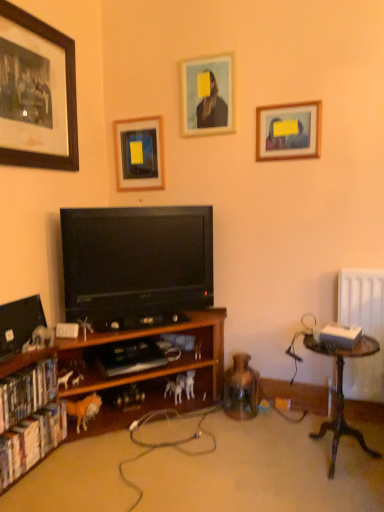
At what (x,y) coordinates should I click in order to perform the action: click on free space to the back side of wooden table at right. Please return your answer as a coordinate pair (x, y). The image size is (384, 512). Looking at the image, I should click on (298, 425).